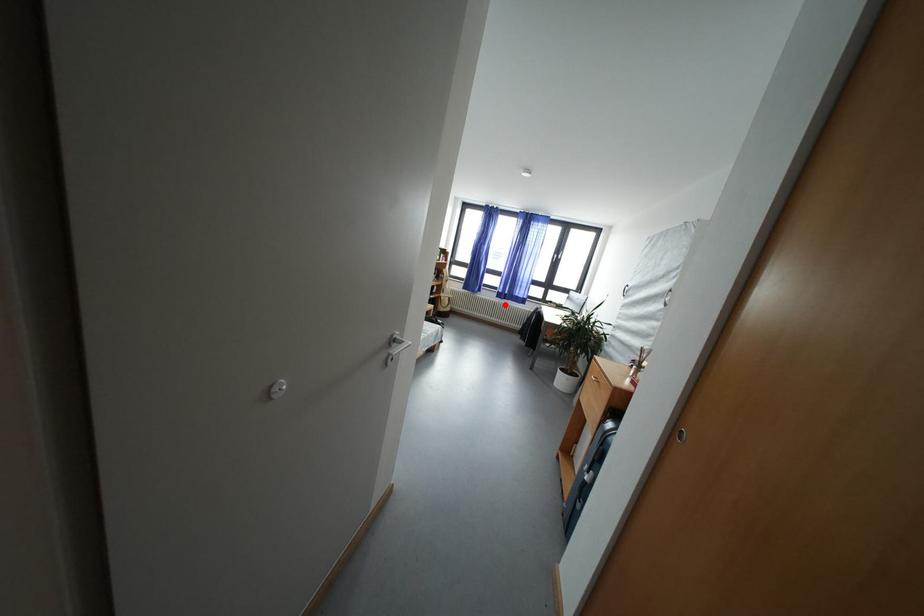
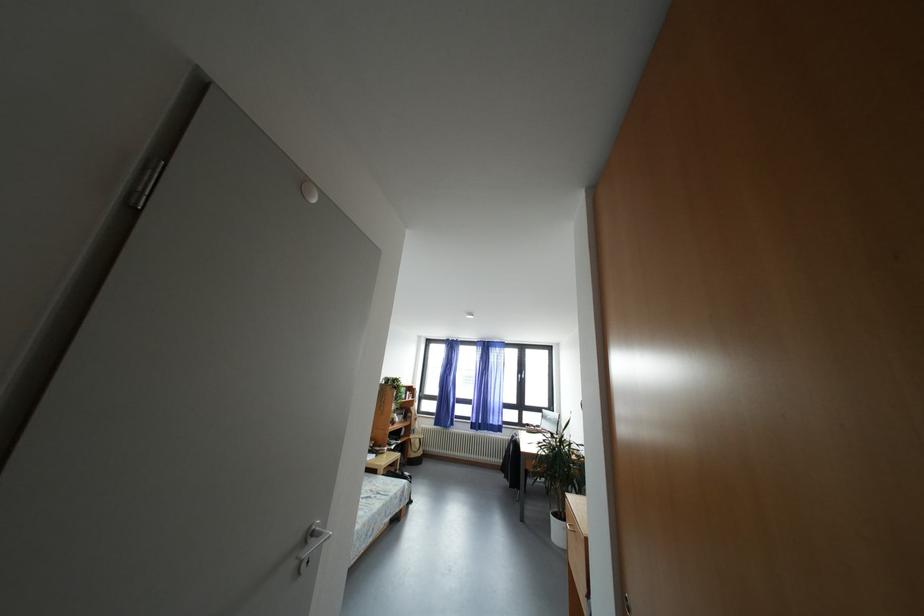
Question: I am providing you with two images of the same scene from different viewpoints. Image1 has a red point marked. In image2, the corresponding 3D location appears at what relative position? Reply with the corresponding letter.

Choices:
 (A) Closer
 (B) Farther

Answer: (B)